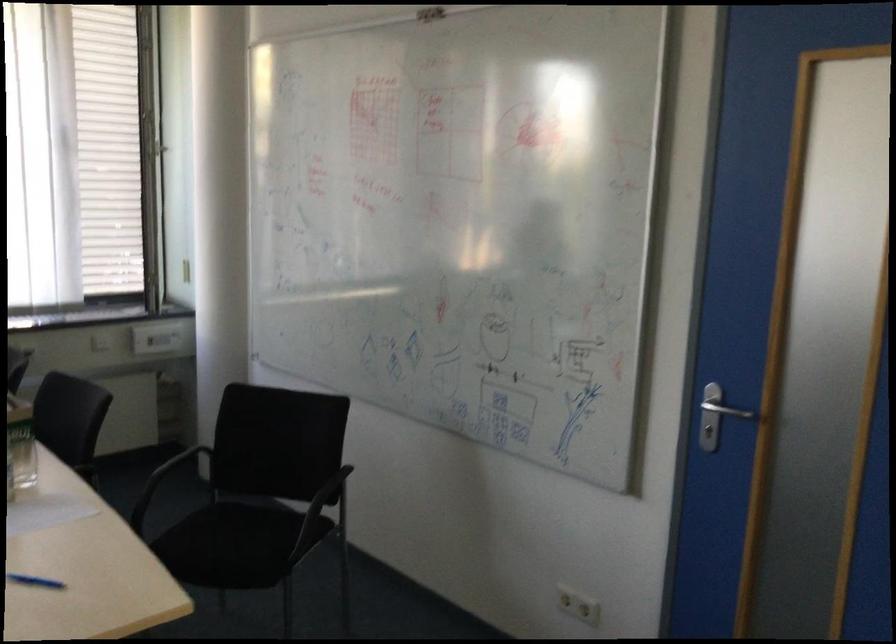
Identify the location of silver door handle. (716, 415).